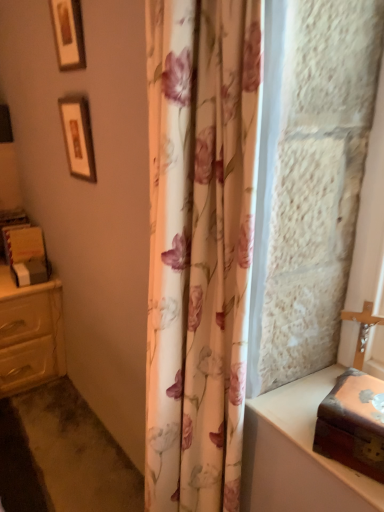
Question: From the image's perspective, is wooden framed picture at upper left, marked as the 2th picture frame in a bottom-to-top arrangement, located above or below matte cream chest of drawers at left?

Choices:
 (A) above
 (B) below

Answer: (A)

Question: Looking at the image, does wooden framed picture at upper left, which is counted as the first picture frame, starting from the top, seem bigger or smaller compared to matte cream chest of drawers at left?

Choices:
 (A) small
 (B) big

Answer: (A)

Question: Estimate the real-world distances between objects in this image. Which object is closer to the wooden framed picture at upper left, which is counted as the first picture frame, starting from the top?

Choices:
 (A) wooden box at right
 (B) matte cream chest of drawers at left
 (C) wooden box at right
 (D) floral fabric shower curtain at center
 (E) wooden framed picture at upper left, marked as the 1th picture frame in a bottom-to-top arrangement

Answer: (E)

Question: Which object is positioned closest to the wooden box at right?

Choices:
 (A) wooden framed picture at upper left, marked as the 2th picture frame in a bottom-to-top arrangement
 (B) wooden box at right
 (C) wooden framed picture at upper left, the second picture frame in the top-to-bottom sequence
 (D) floral fabric shower curtain at center
 (E) matte cream chest of drawers at left

Answer: (B)